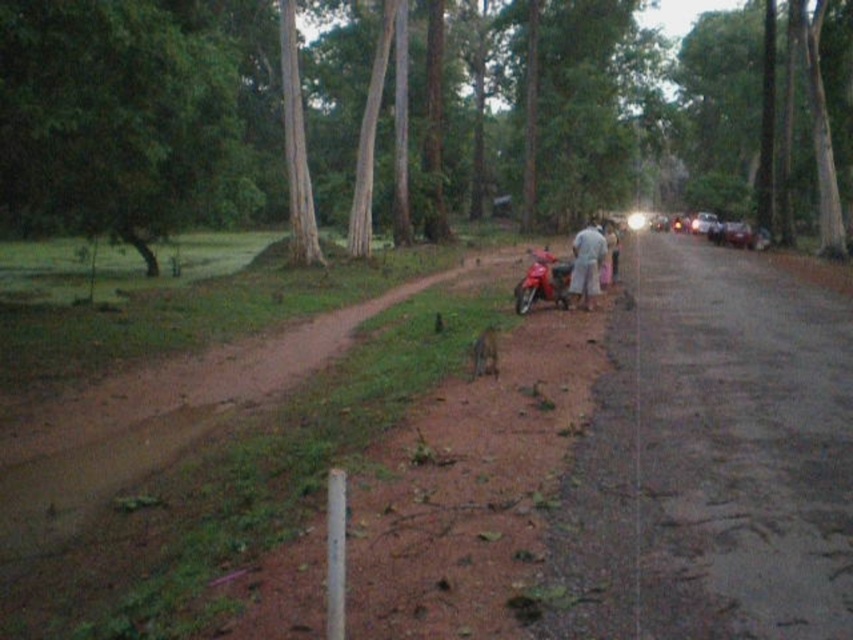
Question: Which of the following is the closest to the observer?

Choices:
 (A) (579, 237)
 (B) (181, 138)
 (C) (73, 163)
 (D) (537, 268)

Answer: (C)

Question: Which is farther from the light gray cotton shirt at center?

Choices:
 (A) green leafy tree at left
 (B) shiny red motorcycle at center
 (C) brown smooth tree at upper center

Answer: (C)

Question: Does light gray cotton shirt at center appear on the left side of shiny red motorcycle at center?

Choices:
 (A) no
 (B) yes

Answer: (A)

Question: From the image, what is the correct spatial relationship of brown smooth tree at upper center in relation to green leafy tree at left?

Choices:
 (A) below
 (B) above

Answer: (B)

Question: Where is light gray cotton shirt at center located in relation to shiny red motorcycle at center in the image?

Choices:
 (A) left
 (B) right

Answer: (B)

Question: Which point is closer to the camera taking this photo?

Choices:
 (A) (556, 269)
 (B) (146, 260)

Answer: (A)